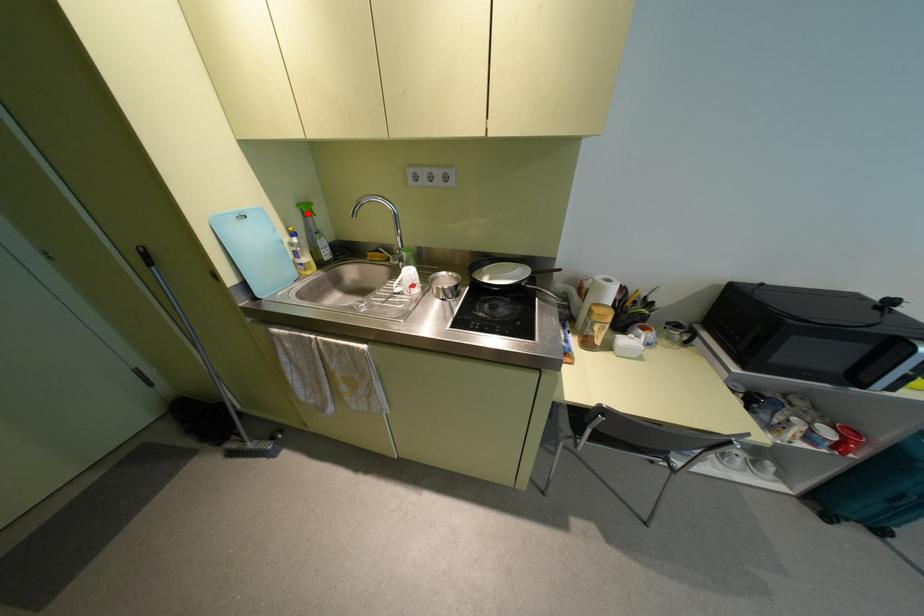
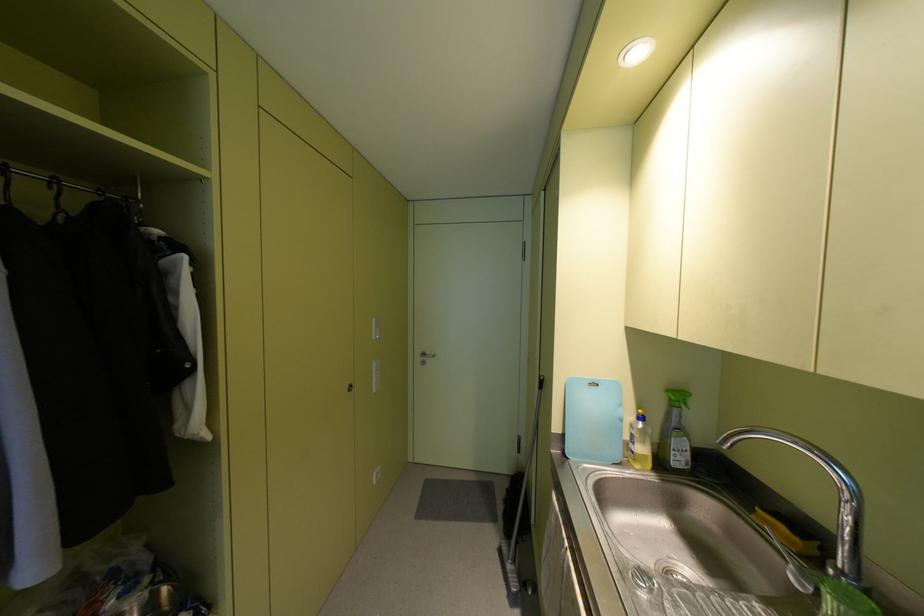
Where in the second image is the point corresponding to the highlighted location from the first image?

(675, 403)